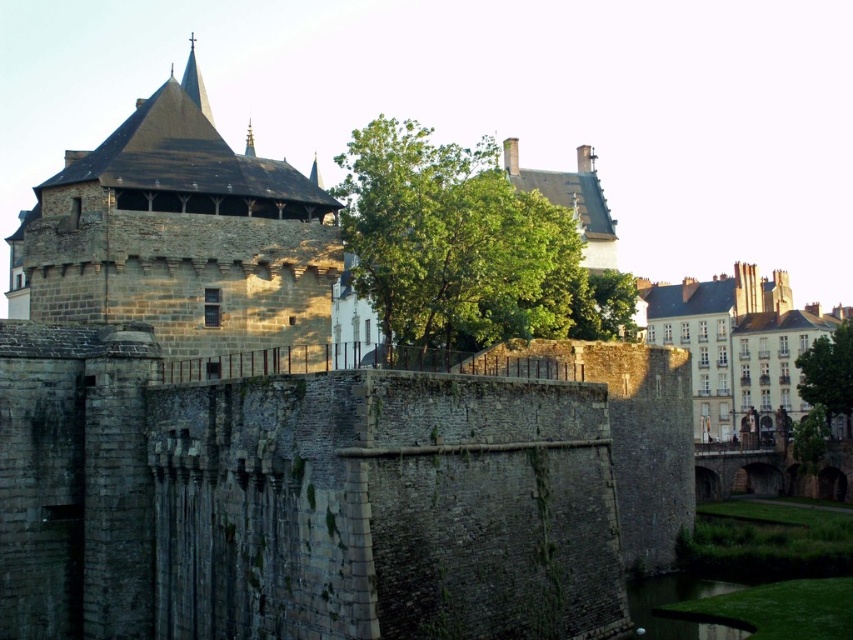
You are a tourist standing at the base of the fortress walls. You see the green leafy tree at center and the green grassy bank at lower right. Which one is closer to your left side?

The green leafy tree at center is positioned on the left side of green grassy bank at lower right, so the green leafy tree at center is closer to your left side.

You are standing at the point with coordinates point (676, 602) in the image of the historic stone fortress. What is the terrain like at that location?

The point (676, 602) corresponds to a green grassy bank at lower right.

You are an architect planning to plant a new tree in the fortress courtyard. You have two options from the image, the green leafy tree at center and the green grassy bank at lower right. Which area can accommodate a wider tree?

The green leafy tree at center has a greater width than the green grassy bank at lower right, so the area where the green leafy tree at center is located can accommodate a wider tree.